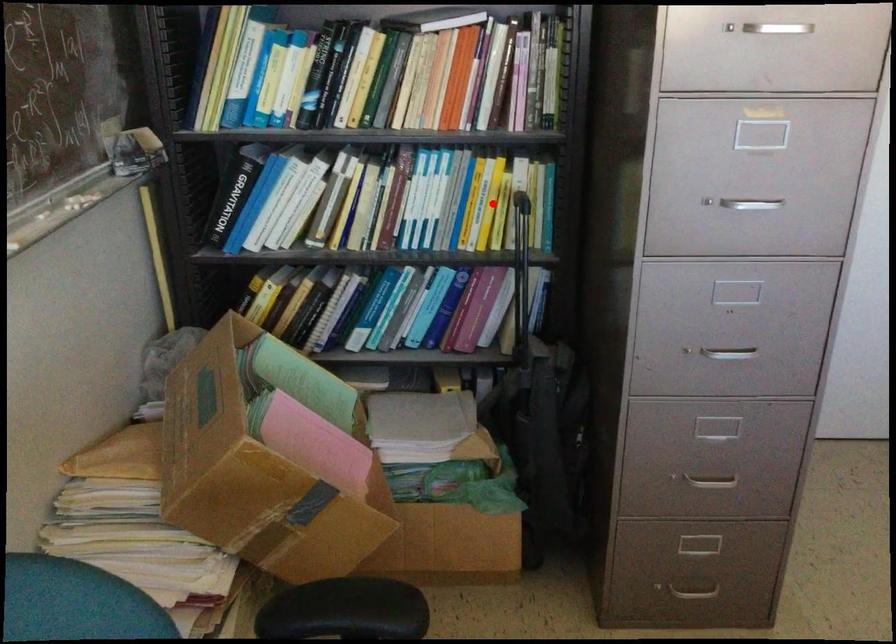
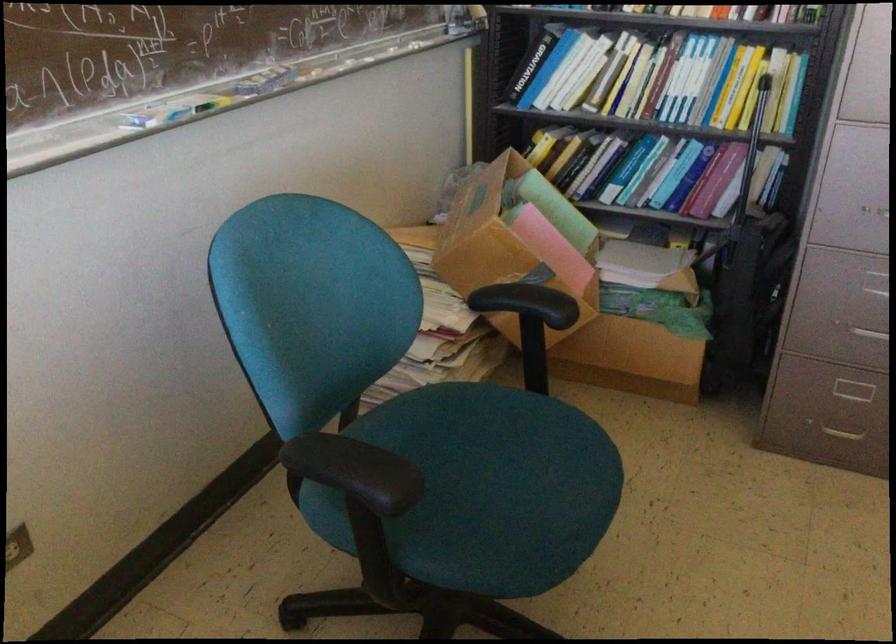
Question: I am providing you with two images of the same scene from different viewpoints. Image1 has a red point marked. In image2, the corresponding 3D location appears at what relative position? Reply with the corresponding letter.

Choices:
 (A) Closer
 (B) Farther

Answer: (B)